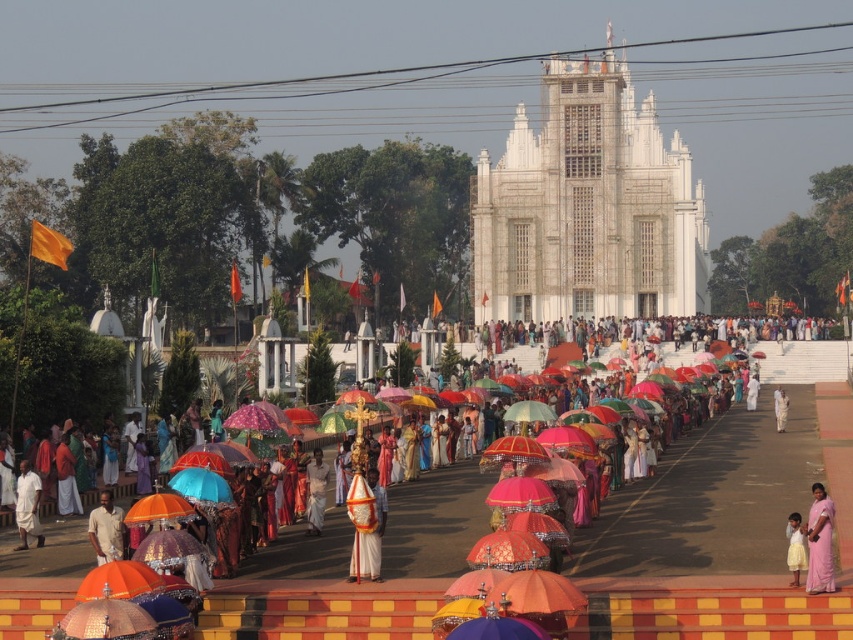
Question: Which object is closer to the camera taking this photo?

Choices:
 (A) matte white dhoti at lower left
 (B) pink silk saree at lower right
 (C) pink silk saree at center
 (D) white cotton shirt at lower left

Answer: (C)

Question: Does white cloth at center appear on the left side of light beige cotton shirt at center?

Choices:
 (A) no
 (B) yes

Answer: (A)

Question: Considering the real-world distances, which object is closest to the white cloth at center?

Choices:
 (A) white cotton shirt at lower left
 (B) pink silk saree at center
 (C) white stone temple at center
 (D) pink fabric at center

Answer: (A)

Question: Is white cotton shirt at lower left above matte white dhoti at lower left?

Choices:
 (A) no
 (B) yes

Answer: (A)

Question: Which of the following is the closest to the observer?

Choices:
 (A) (811, 573)
 (B) (70, 508)
 (C) (109, 532)

Answer: (A)

Question: Does white cotton shirt at lower left have a larger size compared to white cotton dhoti at center?

Choices:
 (A) yes
 (B) no

Answer: (A)